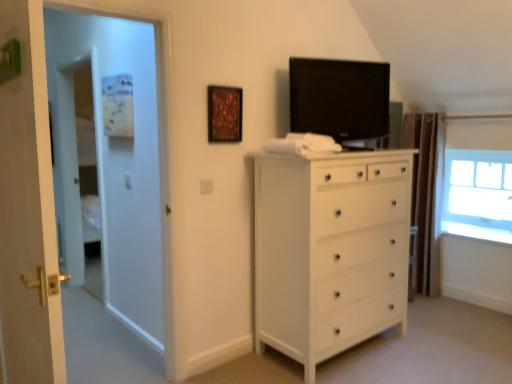
Question: In terms of width, does white glossy door at left look wider or thinner when compared to brown textured curtain at right?

Choices:
 (A) wide
 (B) thin

Answer: (B)

Question: In terms of size, does white glossy door at left appear bigger or smaller than brown textured curtain at right?

Choices:
 (A) small
 (B) big

Answer: (B)

Question: Considering the real-world distances, which object is farthest from the white glossy door at left?

Choices:
 (A) transparent glass window at upper right
 (B) black glossy tv at upper center
 (C) wooden frame at upper center
 (D) brown textured curtain at right
 (E) white wood chest of drawers at center

Answer: (A)

Question: Estimate the real-world distances between objects in this image. Which object is farther from the white glossy door at left?

Choices:
 (A) black glossy tv at upper center
 (B) white wooden door at left
 (C) transparent glass window at upper right
 (D) wooden frame at upper center
 (E) brown textured curtain at right

Answer: (C)